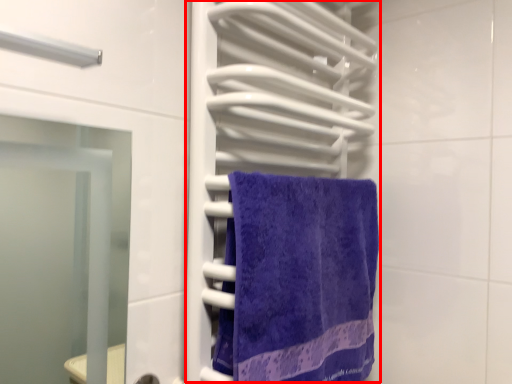
Question: Observing the image, what is the correct spatial positioning of closet (annotated by the red box) in reference to towel?

Choices:
 (A) right
 (B) left

Answer: (B)